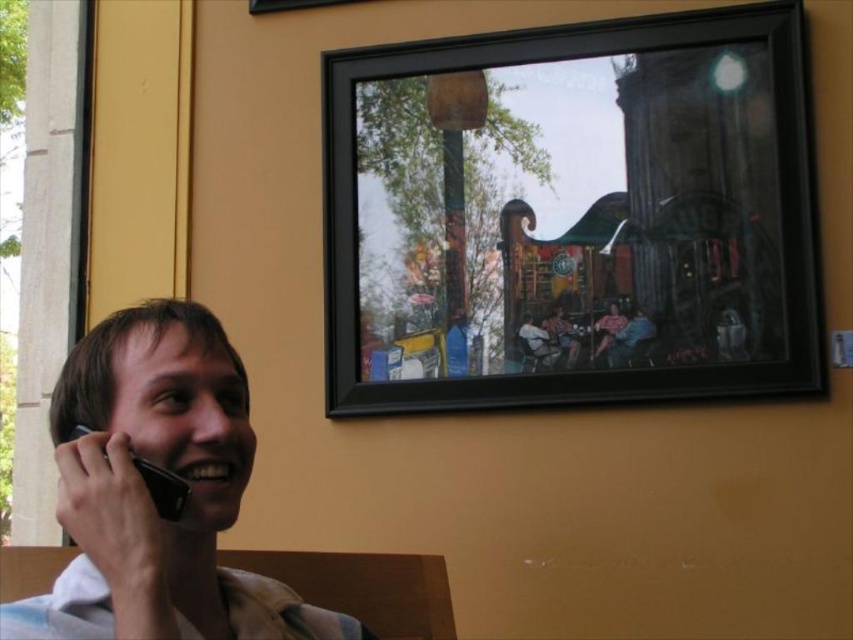
Question: Which object is closer to the camera taking this photo?

Choices:
 (A) black matte picture frame at upper right
 (B) matte black phone at left

Answer: (B)

Question: Does matte black phone at left appear under black matte smartphone at left?

Choices:
 (A) no
 (B) yes

Answer: (B)

Question: Considering the real-world distances, which object is farthest from the black matte smartphone at left?

Choices:
 (A) matte black phone at left
 (B) black matte picture frame at upper right

Answer: (B)

Question: Is black matte picture frame at upper right to the left of black matte smartphone at left from the viewer's perspective?

Choices:
 (A) no
 (B) yes

Answer: (A)

Question: Is matte black phone at left above black matte smartphone at left?

Choices:
 (A) yes
 (B) no

Answer: (B)

Question: Among these points, which one is farthest from the camera?

Choices:
 (A) (117, 524)
 (B) (390, 278)
 (C) (170, 500)

Answer: (B)